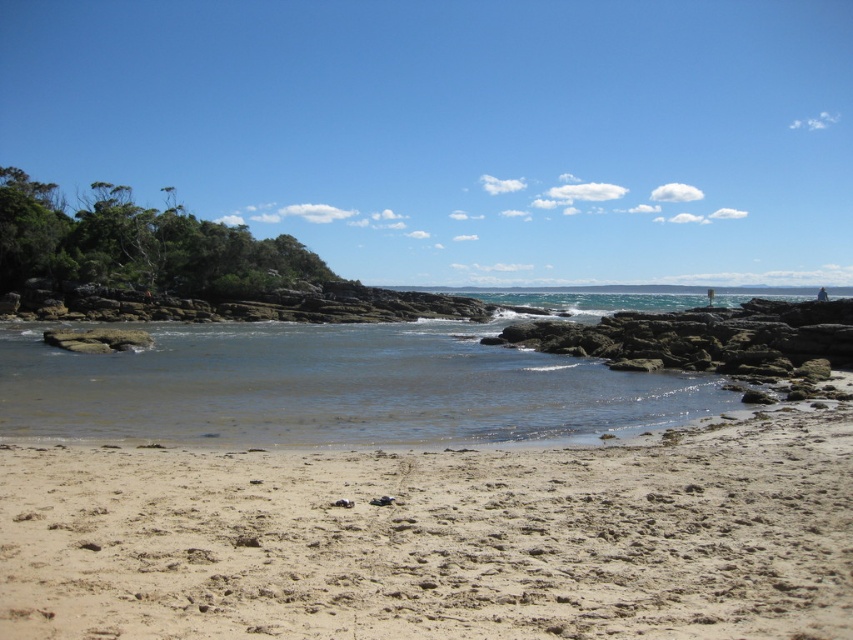
You are standing at the shoreline looking out at the coastal scene. There are two points marked in the image. Which of the two points, point (x=728, y=563) or point (x=526, y=384), is closer to you?

Point (x=728, y=563) is closer to the viewer than point (x=526, y=384).

You are standing on the light brown sandy beach at lower center and want to reach the clear water at center. Which direction should you move to get there?

You should move upward to reach the clear water at center from the light brown sandy beach at lower center since the beach is located below the water.

You are standing at the point marked by coordinates point (439, 538). Looking around, what is the immediate terrain you are standing on?

The point (439, 538) marks light brown sandy beach at lower center, so you are standing on a light brown sandy beach at lower center.